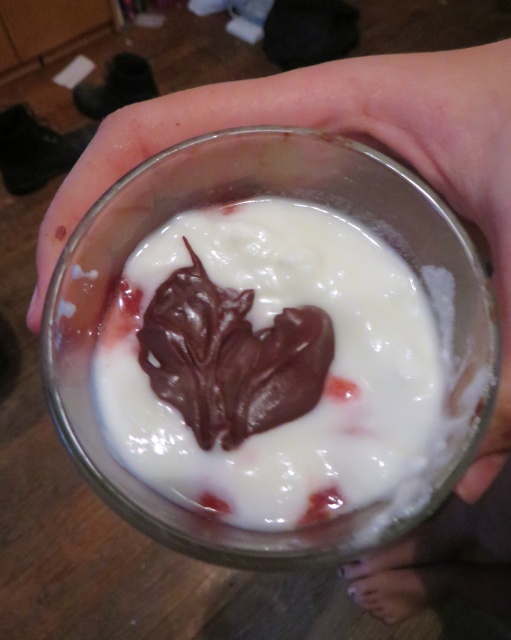
You are holding a smooth white yogurt at center in your hand. If your hand is 20 centimeters away from your mouth, can you bring the yogurt to your mouth without moving your hand?

The smooth white yogurt at center is 21.06 centimeters away from the viewer. Since your hand is only 20 centimeters away from your mouth, you cannot bring the yogurt to your mouth without moving your hand because the yogurt is slightly farther than the distance your hand can reach.

You are a food photographer trying to capture the smooth white yogurt at center and the transparent glass at center. Which object is closer to your camera lens?

The smooth white yogurt at center is closer to the camera lens because it is positioned further to the viewer than the transparent glass at center.

You are trying to place a small spoon between the smooth white yogurt at center and the transparent glass at center. Can you fit it there?

The smooth white yogurt at center is 1.59 inches away from transparent glass at center, so yes, you can fit a small spoon between them since the distance is sufficient.